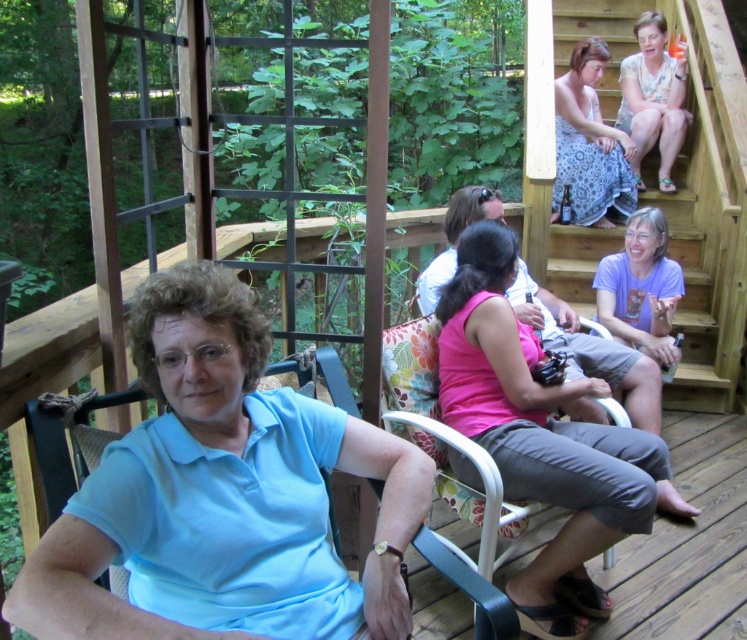
Question: From the image, what is the correct spatial relationship of pink fabric tank top at center in relation to floral fabric chair at center?

Choices:
 (A) right
 (B) left

Answer: (A)

Question: Which object is positioned farthest from the purple cotton shirt at lower right?

Choices:
 (A) wooden stairs at upper right
 (B) pink fabric tank top at center

Answer: (B)

Question: Which of the following is the farthest from the observer?

Choices:
 (A) (562, 173)
 (B) (654, 284)

Answer: (A)

Question: Is pink fabric tank top at center thinner than patterned fabric dress at upper right?

Choices:
 (A) no
 (B) yes

Answer: (A)

Question: Can you confirm if purple cotton shirt at lower right is smaller than floral fabric chair at center?

Choices:
 (A) no
 (B) yes

Answer: (B)

Question: Considering the real-world distances, which object is closest to the light blue fabric rocking chair at center?

Choices:
 (A) patterned fabric dress at upper right
 (B) wooden stairs at upper right
 (C) purple cotton shirt at lower right
 (D) floral dress at upper right

Answer: (C)